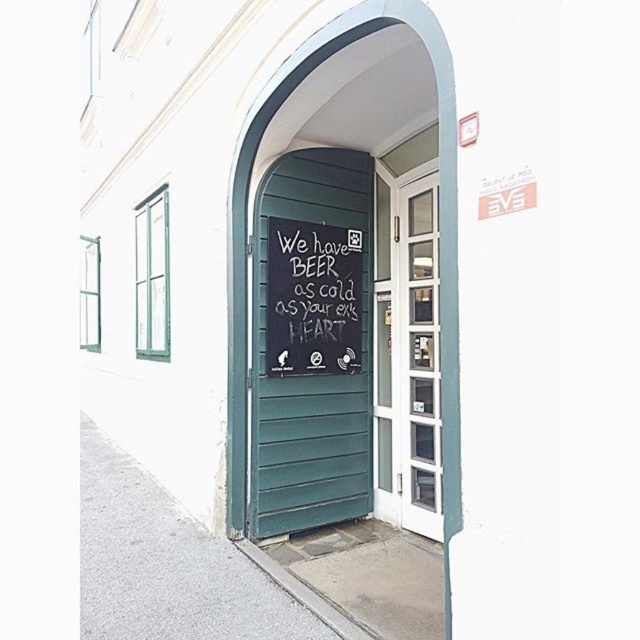
Question: Among these objects, which one is nearest to the camera?

Choices:
 (A) white glass door at center
 (B) chalkboard at center

Answer: (A)

Question: Which object is positioned closest to the white glass door at center?

Choices:
 (A) chalkboard at center
 (B) green wooden door at center

Answer: (B)

Question: Which object is the farthest from the green wooden door at center?

Choices:
 (A) white glass door at center
 (B) chalkboard at center

Answer: (A)

Question: Is green wooden door at center to the left of white glass door at center from the viewer's perspective?

Choices:
 (A) yes
 (B) no

Answer: (A)

Question: Can you confirm if green wooden door at center is wider than white glass door at center?

Choices:
 (A) no
 (B) yes

Answer: (B)

Question: Can you confirm if green wooden door at center is smaller than white glass door at center?

Choices:
 (A) no
 (B) yes

Answer: (A)